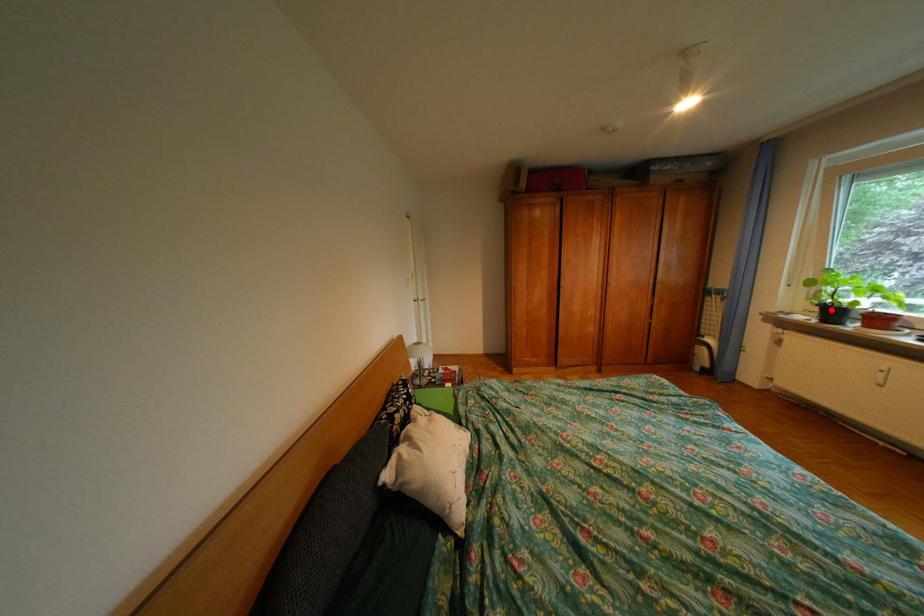
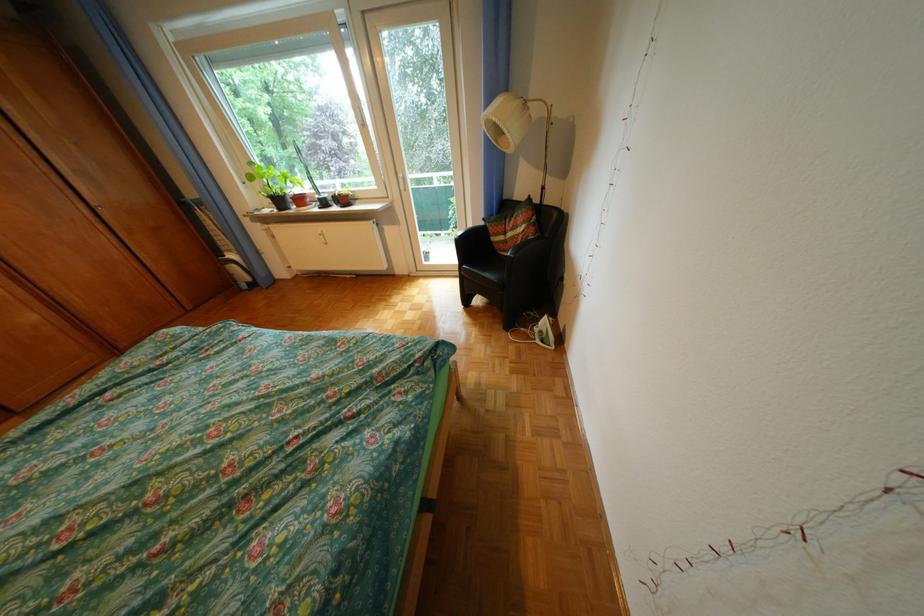
Question: I am providing you with two images of the same scene from different viewpoints. In image1, a red point is highlighted. Considering the same 3D point in image2, which of the following is correct?

Choices:
 (A) It is closer
 (B) It is farther

Answer: (A)